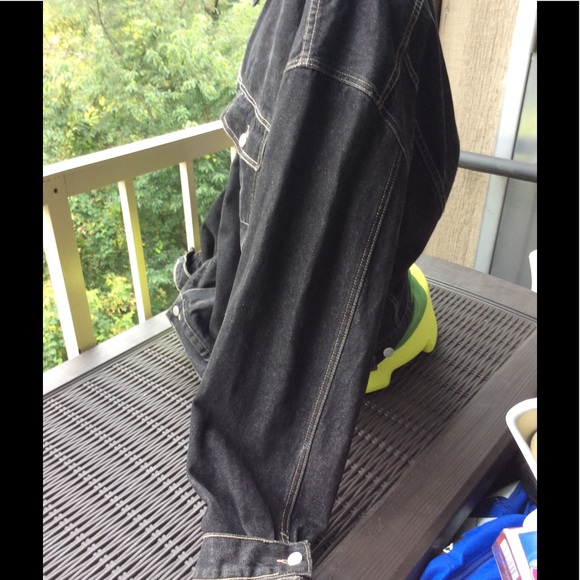
The height and width of the screenshot is (580, 580). I want to click on bench, so click(126, 505).